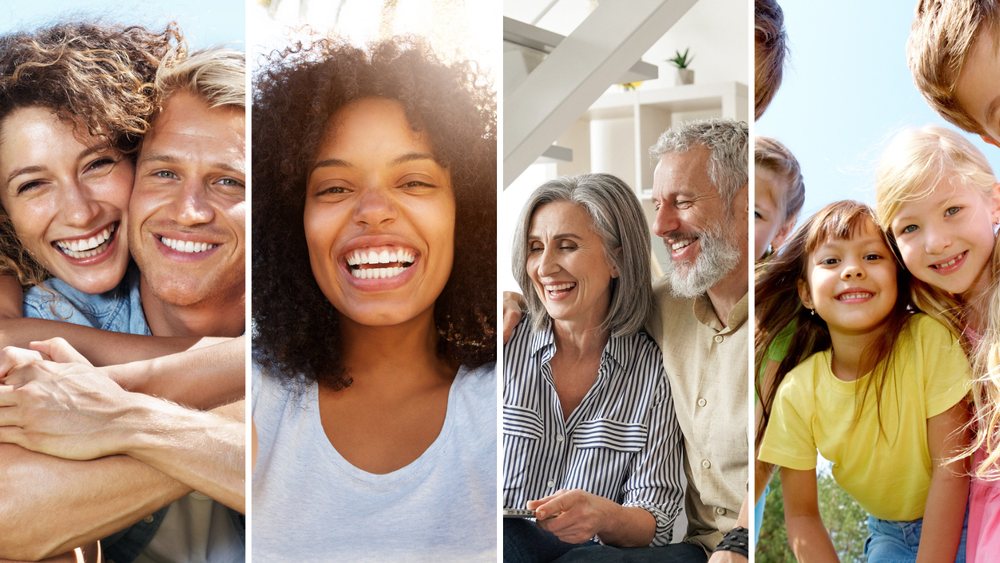
Locate an element on the screen. collage photos is located at coordinates (172, 361), (377, 400), (577, 392), (831, 357).